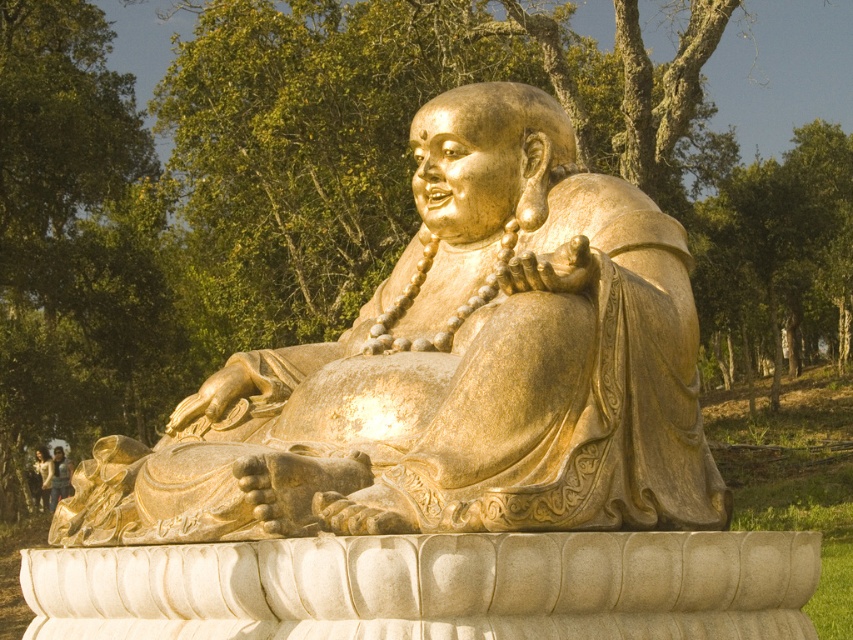
Question: Does gold polished statue at center appear under golden statue at center?

Choices:
 (A) yes
 (B) no

Answer: (B)

Question: Which object is closer to the camera taking this photo?

Choices:
 (A) gold polished statue at center
 (B) golden statue at center
 (C) light brown leather jacket at lower left

Answer: (A)

Question: Among these objects, which one is farthest from the camera?

Choices:
 (A) gold polished statue at center
 (B) light brown leather jacket at lower left

Answer: (B)

Question: Considering the relative positions of gold polished statue at center and golden statue at center in the image provided, where is gold polished statue at center located with respect to golden statue at center?

Choices:
 (A) left
 (B) right

Answer: (B)

Question: Does gold polished statue at center appear over light brown leather jacket at lower left?

Choices:
 (A) no
 (B) yes

Answer: (B)

Question: Which point is farther to the camera?

Choices:
 (A) gold polished statue at center
 (B) golden statue at center

Answer: (B)